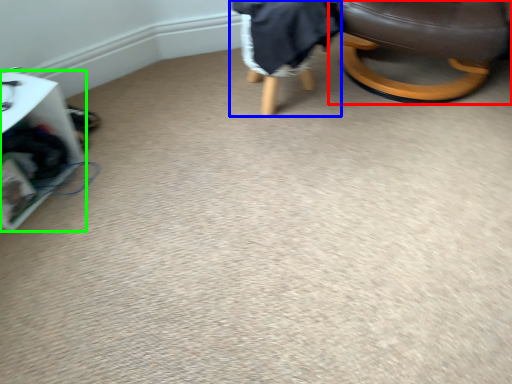
Question: Considering the real-world distances, which object is farthest from chair (highlighted by a red box)? bean bag chair (highlighted by a blue box) or furniture (highlighted by a green box)?

Choices:
 (A) bean bag chair
 (B) furniture

Answer: (B)